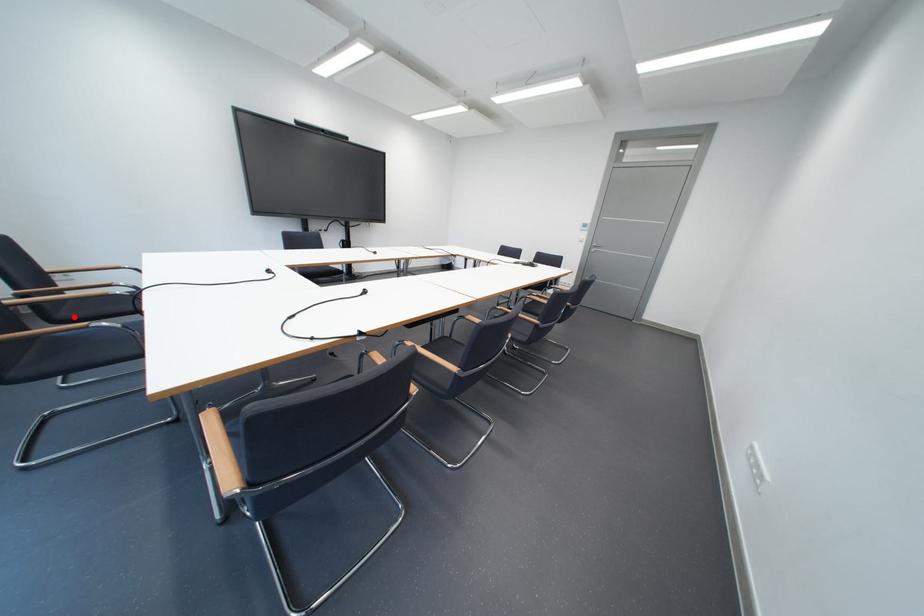
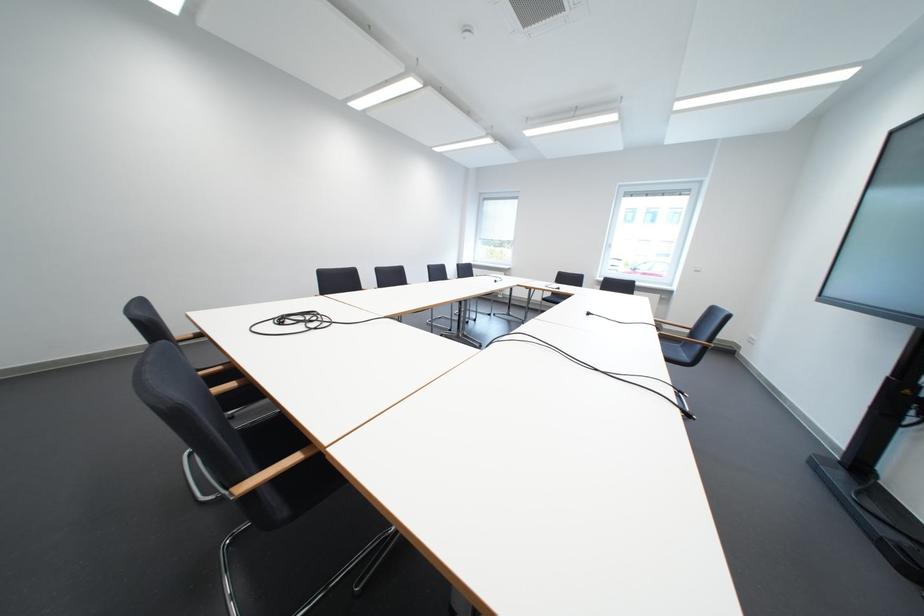
Question: I am providing you with two images of the same scene from different viewpoints. A red point is marked on the first image. Can you still see the location of the red point in image 2?

Choices:
 (A) Yes
 (B) No

Answer: (B)